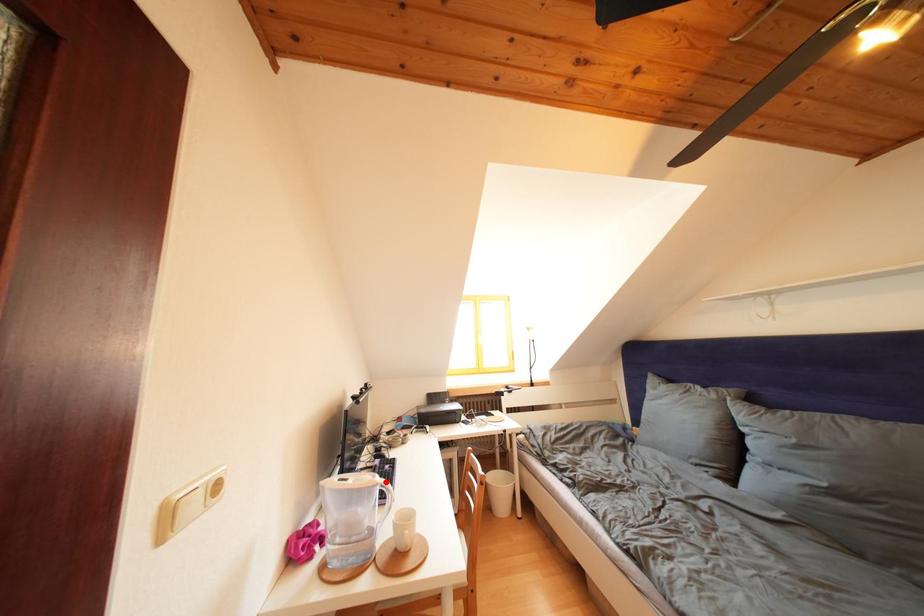
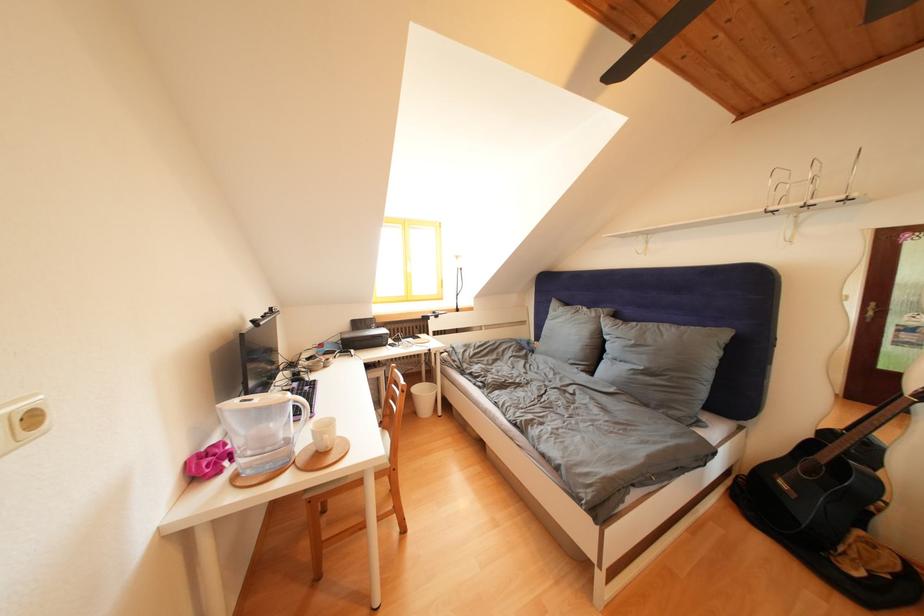
The point at the highlighted location is marked in the first image. Where is the corresponding point in the second image?

(297, 400)